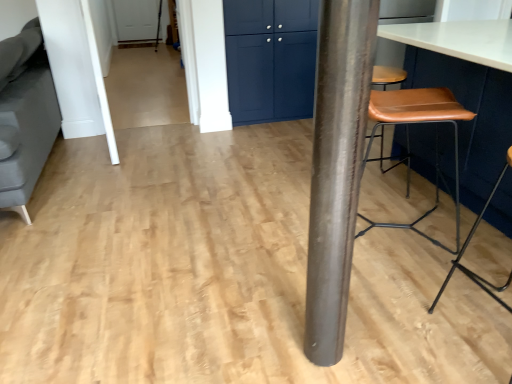
Where is `vacant space to the right of brown leather stool at right`? The height and width of the screenshot is (384, 512). vacant space to the right of brown leather stool at right is located at coordinates (457, 224).